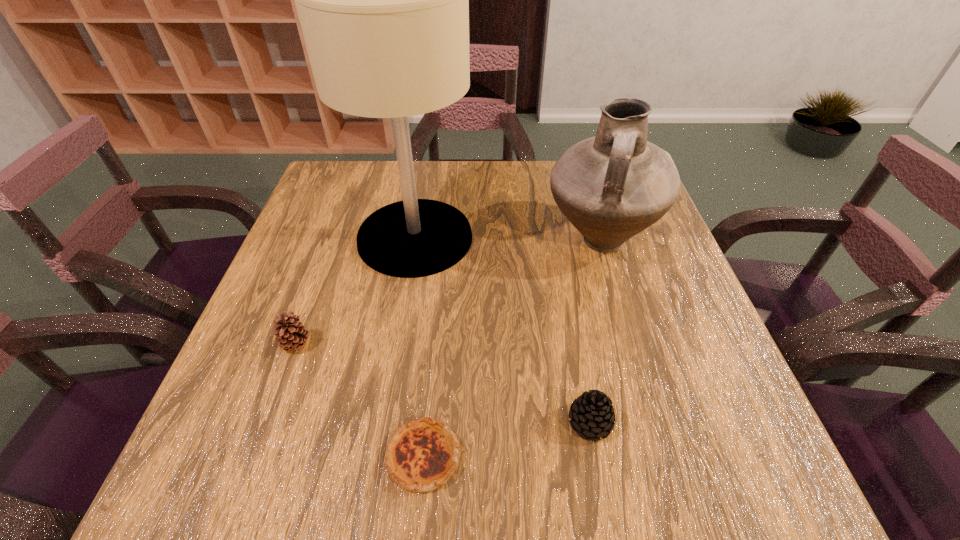
The height and width of the screenshot is (540, 960). Identify the location of table lamp. (383, 0).

Find the location of a particular element. the second tallest object is located at coordinates (611, 187).

Image resolution: width=960 pixels, height=540 pixels. In order to click on the farther pinecone in this screenshot , I will do `click(291, 335)`.

The width and height of the screenshot is (960, 540). Find the location of `the left pinecone`. the left pinecone is located at coordinates (291, 335).

Image resolution: width=960 pixels, height=540 pixels. I want to click on the right pinecone, so click(592, 414).

The image size is (960, 540). Find the location of `quiche`. quiche is located at coordinates click(x=422, y=455).

Identify the location of free point located 0.110m on the front of the tallest object. (402, 316).

Identify the location of vacant space located 0.190m on the handle side of the pitcher. This screenshot has width=960, height=540. (632, 351).

Where is `vacant space located on the right of the leftmost object`? This screenshot has height=540, width=960. vacant space located on the right of the leftmost object is located at coordinates (509, 345).

Image resolution: width=960 pixels, height=540 pixels. Find the location of `free space located 0.050m at the narrow end of the right pinecone`. free space located 0.050m at the narrow end of the right pinecone is located at coordinates (600, 476).